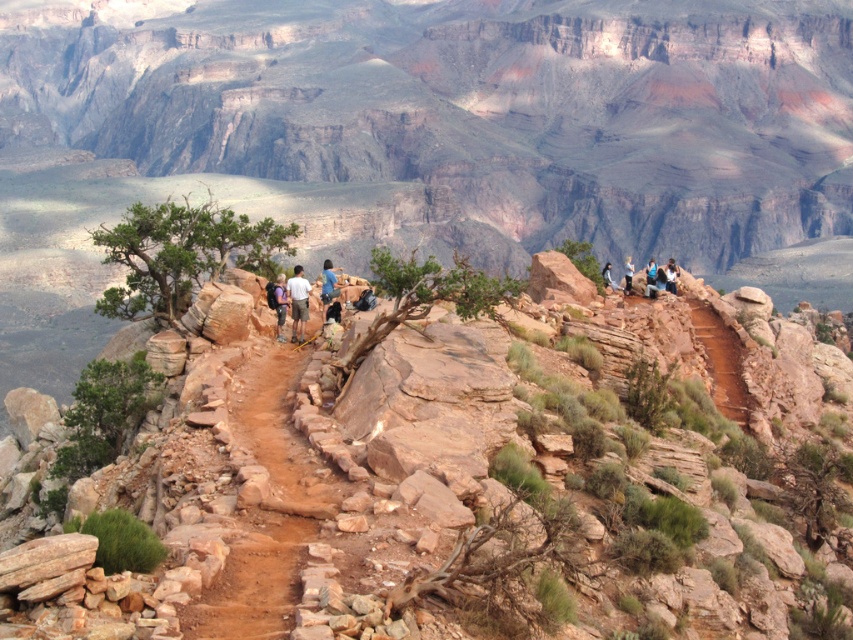
You are standing at the overlook of the Grand Canyon and want to take a photo of the two points marked in the image. Which point, point [306,296] or point [274,289], is closer to you?

Point [306,296] is closer to the viewer than point [274,289].